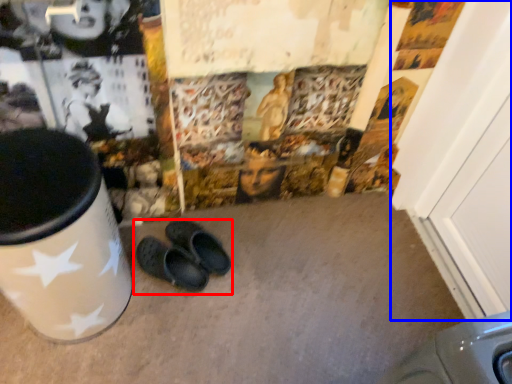
Question: Which object appears farthest to the camera in this image, footwear (highlighted by a red box) or door (highlighted by a blue box)?

Choices:
 (A) footwear
 (B) door

Answer: (A)